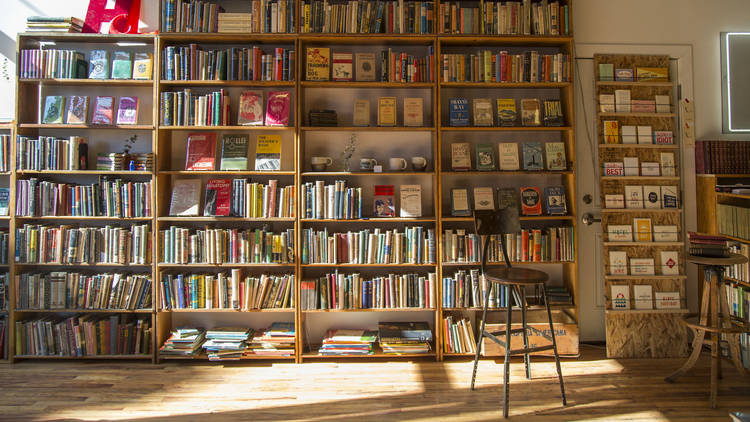
Locate an element on the screen. The image size is (750, 422). dark wooden tall stool is located at coordinates (513, 276).